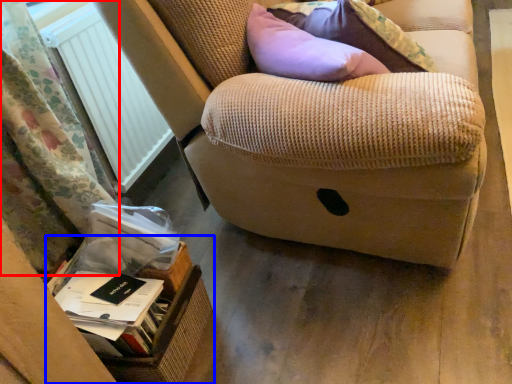
Question: Which object is closer to the camera taking this photo, curtain (highlighted by a red box) or cardboard box (highlighted by a blue box)?

Choices:
 (A) curtain
 (B) cardboard box

Answer: (A)